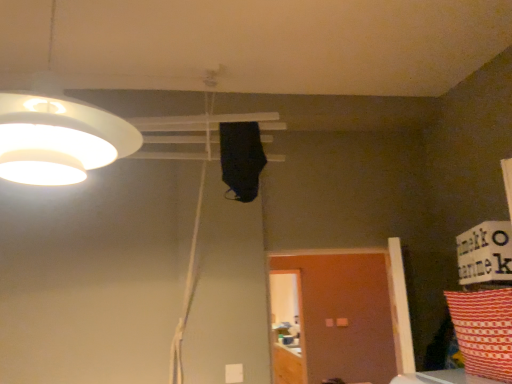
Image resolution: width=512 pixels, height=384 pixels. What do you see at coordinates (344, 315) in the screenshot?
I see `brown matte door at lower right` at bounding box center [344, 315].

This screenshot has height=384, width=512. Describe the element at coordinates (59, 139) in the screenshot. I see `white matte lampshade at upper left` at that location.

The width and height of the screenshot is (512, 384). I want to click on brown matte door at lower right, so click(344, 315).

Which is more to the left, brown matte door at lower right or red and white patterned pillow at lower right?

brown matte door at lower right is more to the left.

Does brown matte door at lower right have a greater height compared to red and white patterned pillow at lower right?

Correct, brown matte door at lower right is much taller as red and white patterned pillow at lower right.

Which is correct: brown matte door at lower right is inside red and white patterned pillow at lower right, or outside of it?

brown matte door at lower right is located beyond the bounds of red and white patterned pillow at lower right.

You are a GUI agent. You are given a task and a screenshot of the screen. Output one action in this format:
    pyautogui.click(x=<x>, y=<y>)
    Task: Click on the pillow that is behind the white matte lampshade at upper left
    
    Given the screenshot: What is the action you would take?
    pyautogui.click(x=484, y=331)

From a real-world perspective, which is physically below, white matte lampshade at upper left or red and white patterned pillow at lower right?

red and white patterned pillow at lower right, from a real-world perspective.

Can you confirm if white matte lampshade at upper left is shorter than red and white patterned pillow at lower right?

In fact, white matte lampshade at upper left may be taller than red and white patterned pillow at lower right.

From the picture: In the image, is red and white patterned pillow at lower right on the left side or the right side of brown matte door at lower right?

From the image, it's evident that red and white patterned pillow at lower right is to the right of brown matte door at lower right.

How much distance is there between red and white patterned pillow at lower right and brown matte door at lower right?

3.55 meters.

Can you tell me how much red and white patterned pillow at lower right and brown matte door at lower right differ in facing direction?

The facing directions of red and white patterned pillow at lower right and brown matte door at lower right are 86.1 degrees apart.

Is red and white patterned pillow at lower right directly adjacent to brown matte door at lower right?

They are not placed beside each other.

Is brown matte door at lower right in contact with white matte lampshade at upper left?

No.

Considering the relative sizes of brown matte door at lower right and white matte lampshade at upper left in the image provided, is brown matte door at lower right shorter than white matte lampshade at upper left?

In fact, brown matte door at lower right may be taller than white matte lampshade at upper left.

Is brown matte door at lower right to the left or to the right of white matte lampshade at upper left in the image?

From the image, it's evident that brown matte door at lower right is to the right of white matte lampshade at upper left.

Is brown matte door at lower right behind white matte lampshade at upper left?

Yes, the depth of brown matte door at lower right is greater than that of white matte lampshade at upper left.

Is white matte lampshade at upper left bigger or smaller than brown matte door at lower right?

white matte lampshade at upper left is smaller than brown matte door at lower right.

Is there a large distance between white matte lampshade at upper left and brown matte door at lower right?

Indeed, white matte lampshade at upper left is not near brown matte door at lower right.

Is white matte lampshade at upper left turned away from brown matte door at lower right?

white matte lampshade at upper left does not have its back to brown matte door at lower right.

Looking at this image, from the image's perspective, is red and white patterned pillow at lower right under white matte lampshade at upper left?

Yes, from the image's perspective, red and white patterned pillow at lower right is beneath white matte lampshade at upper left.

How many degrees apart are the facing directions of red and white patterned pillow at lower right and white matte lampshade at upper left?

They differ by 89.8 degrees in their facing directions.

Is point (466, 369) behind point (61, 162)?

Yes, point (466, 369) is behind point (61, 162).

Looking at the image, does red and white patterned pillow at lower right seem bigger or smaller compared to white matte lampshade at upper left?

Considering their sizes, red and white patterned pillow at lower right takes up less space than white matte lampshade at upper left.

In order to click on door below the red and white patterned pillow at lower right (from a real-world perspective) in this screenshot , I will do `click(344, 315)`.

Where is `pillow on the right of white matte lampshade at upper left`? pillow on the right of white matte lampshade at upper left is located at coordinates (484, 331).

Estimate the real-world distances between objects in this image. Which object is closer to red and white patterned pillow at lower right, white matte lampshade at upper left or brown matte door at lower right?

Among the two, white matte lampshade at upper left is located nearer to red and white patterned pillow at lower right.

In the scene shown: When comparing their distances from white matte lampshade at upper left, does brown matte door at lower right or red and white patterned pillow at lower right seem closer?

Based on the image, red and white patterned pillow at lower right appears to be nearer to white matte lampshade at upper left.

Based on their spatial positions, is red and white patterned pillow at lower right or brown matte door at lower right further from white matte lampshade at upper left?

brown matte door at lower right is positioned further to the anchor white matte lampshade at upper left.

Looking at the image, which one is located further to red and white patterned pillow at lower right, brown matte door at lower right or white matte lampshade at upper left?

Among the two, brown matte door at lower right is located further to red and white patterned pillow at lower right.

When comparing their distances from brown matte door at lower right, does white matte lampshade at upper left or red and white patterned pillow at lower right seem further?

The object further to brown matte door at lower right is white matte lampshade at upper left.

From the image, which object appears to be nearer to brown matte door at lower right, red and white patterned pillow at lower right or white matte lampshade at upper left?

red and white patterned pillow at lower right is positioned closer to the anchor brown matte door at lower right.

At what (x,y) coordinates should I click in order to perform the action: click on door situated between white matte lampshade at upper left and red and white patterned pillow at lower right from left to right. Please return your answer as a coordinate pair (x, y). Looking at the image, I should click on (344, 315).